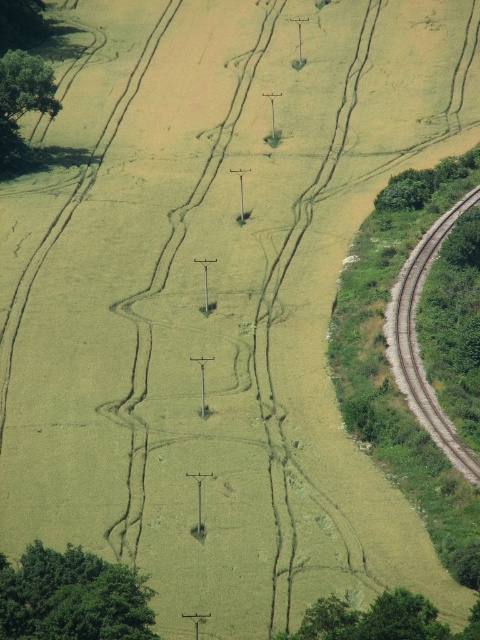
Question: Which is nearer to the green leafy tree at right?

Choices:
 (A) green leafy tree at upper left
 (B) brown gravel train track at right

Answer: (B)

Question: Considering the relative positions of brown gravel train track at right and green leafy tree at upper left in the image provided, where is brown gravel train track at right located with respect to green leafy tree at upper left?

Choices:
 (A) above
 (B) below

Answer: (B)

Question: Which of the following is the farthest from the observer?

Choices:
 (A) (142, 612)
 (B) (393, 182)
 (C) (467, 204)

Answer: (B)

Question: Which of the following is the closest to the observer?

Choices:
 (A) (37, 106)
 (B) (456, 211)
 (C) (408, 202)

Answer: (B)

Question: Is brown gravel train track at right in front of green leafy tree at right?

Choices:
 (A) no
 (B) yes

Answer: (B)

Question: Is brown gravel train track at right in front of green leafy tree at upper left?

Choices:
 (A) yes
 (B) no

Answer: (A)